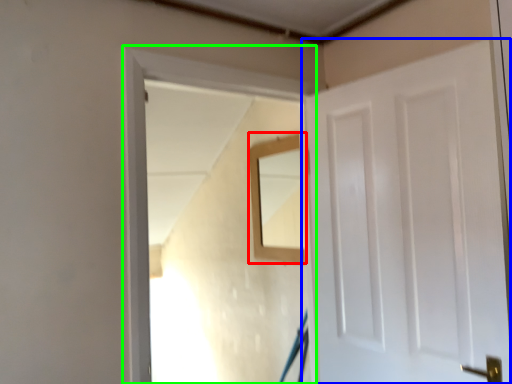
Question: Which object is positioned farthest from mirror (highlighted by a red box)? Select from door (highlighted by a blue box) and window frame (highlighted by a green box).

Choices:
 (A) door
 (B) window frame

Answer: (A)